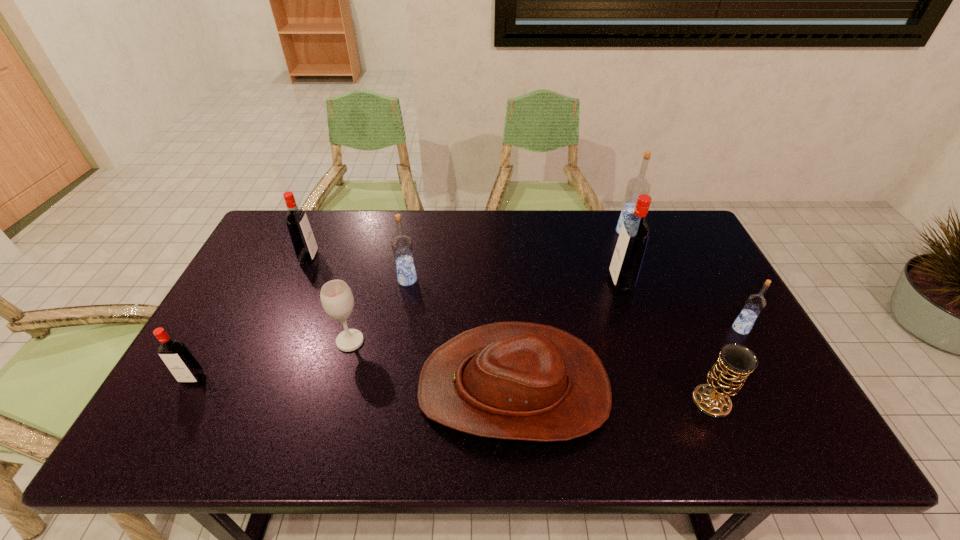
At what (x,y) coordinates should I click in order to perform the action: click on vacant space located on the front and back of the fifth vodka from right to left. Please return your answer as a coordinate pair (x, y). This screenshot has height=540, width=960. Looking at the image, I should click on (407, 258).

Locate an element on the screen. free spot located 0.340m on the right of the third vodka from left to right is located at coordinates (529, 280).

Find the location of a particular element. The image size is (960, 540). vacant space located 0.070m on the right of the wineglass is located at coordinates (391, 341).

This screenshot has width=960, height=540. What are the coordinates of `vacant position located on the front and back of the leftmost red vodka` in the screenshot? It's located at (x=168, y=423).

Identify the location of free space located 0.070m on the back of the rightmost vodka. This screenshot has width=960, height=540. (727, 304).

Image resolution: width=960 pixels, height=540 pixels. I want to click on blank area located on the back of the chalice, so click(x=666, y=298).

Locate an element on the screen. vacant space located on the front-facing side of the fifth object from left to right is located at coordinates (294, 388).

What are the coordinates of `free space located on the front-facing side of the fifth object from left to right` in the screenshot? It's located at (352, 388).

Identify the location of free space located on the front-facing side of the fifth object from left to right. The height and width of the screenshot is (540, 960). (274, 388).

I want to click on chalice at the near edge, so click(726, 377).